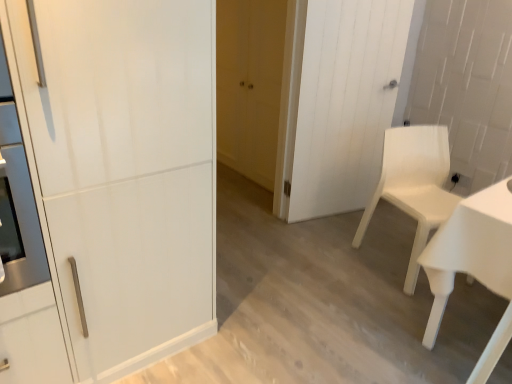
Identify the location of space that is in front of white plastic chair at right. The height and width of the screenshot is (384, 512). (418, 310).